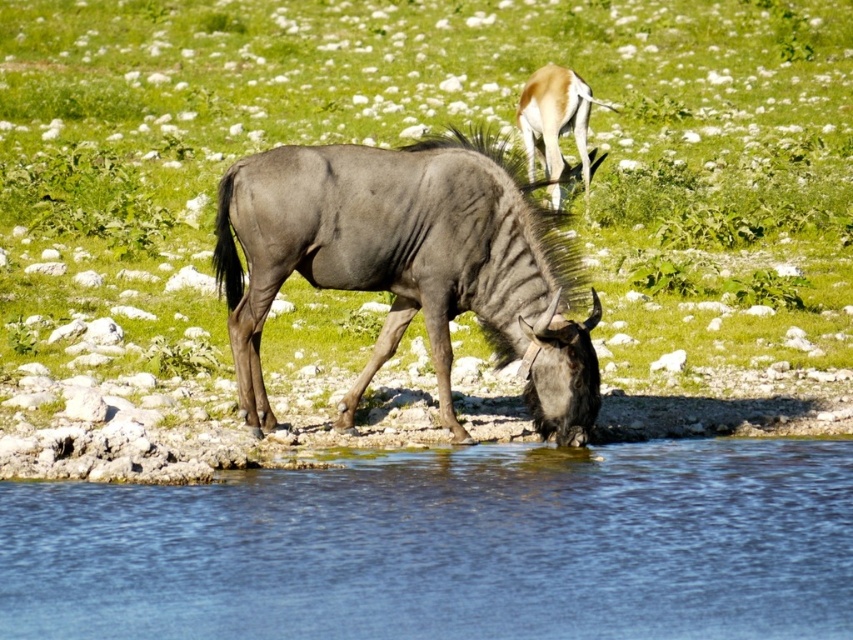
Which of these two, green grass at center or transparent blue water at lower center, stands shorter?

transparent blue water at lower center

Is point (544, 16) in front of point (73, 588)?

No.

You are a GUI agent. You are given a task and a screenshot of the screen. Output one action in this format:
    pyautogui.click(x=<x>, y=<y>)
    Task: Click on the green grass at center
    The height and width of the screenshot is (640, 853).
    Given the screenshot: What is the action you would take?
    pyautogui.click(x=434, y=129)

Is gray matte/waxy wildebeest at center taller than light brown fur antelope at upper center?

In fact, gray matte/waxy wildebeest at center may be shorter than light brown fur antelope at upper center.

Is point (589, 371) closer to viewer compared to point (572, 124)?

Yes, it is.

Is point (550, 268) positioned in front of point (583, 93)?

Yes.

You are a GUI agent. You are given a task and a screenshot of the screen. Output one action in this format:
    pyautogui.click(x=<x>, y=<y>)
    Task: Click on the gray matte/waxy wildebeest at center
    The image size is (853, 640).
    Given the screenshot: What is the action you would take?
    pyautogui.click(x=409, y=266)

Between transparent blue water at lower center and gray matte/waxy wildebeest at center, which one appears on the left side from the viewer's perspective?

From the viewer's perspective, gray matte/waxy wildebeest at center appears more on the left side.

Can you confirm if transparent blue water at lower center is taller than gray matte/waxy wildebeest at center?

No, transparent blue water at lower center is not taller than gray matte/waxy wildebeest at center.

Between point (259, 572) and point (508, 353), which one is positioned behind?

The point (508, 353) is behind.

What are the coordinates of `transparent blue water at lower center` in the screenshot? It's located at (448, 547).